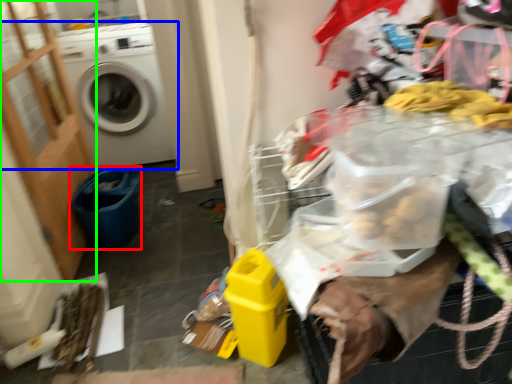
Question: Based on their relative distances, which object is farther from recycling bin (highlighted by a red box)? Choose from washing machine (highlighted by a blue box) and screen door (highlighted by a green box).

Choices:
 (A) washing machine
 (B) screen door

Answer: (A)